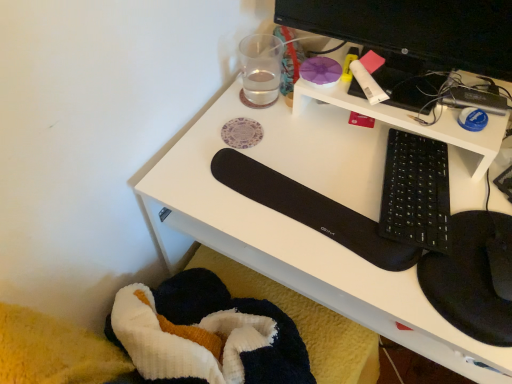
Question: Is white matte glue stick at upper right, arranged as the second stationery when viewed from the left, wider than transparent glass at upper center, the 1th stationery from the back?

Choices:
 (A) no
 (B) yes

Answer: (B)

Question: Is white matte glue stick at upper right, arranged as the second stationery when viewed from the left, at the left side of transparent glass at upper center, the 1th stationery from the back?

Choices:
 (A) yes
 (B) no

Answer: (B)

Question: From the image's perspective, is white matte glue stick at upper right, positioned as the first stationery in right-to-left order, below transparent glass at upper center, which is the 2th stationery from right to left?

Choices:
 (A) yes
 (B) no

Answer: (A)

Question: From a real-world perspective, is white matte glue stick at upper right, positioned as the first stationery in right-to-left order, positioned under transparent glass at upper center, which ranks as the second stationery in front-to-back order, based on gravity?

Choices:
 (A) yes
 (B) no

Answer: (B)

Question: Is white matte glue stick at upper right, positioned as the 1th stationery in front-to-back order, shorter than transparent glass at upper center, which ranks as the second stationery in front-to-back order?

Choices:
 (A) yes
 (B) no

Answer: (A)

Question: Is transparent glass at upper center, which is the 2th stationery from right to left, taller or shorter than black matte keyboard at center-right?

Choices:
 (A) tall
 (B) short

Answer: (A)

Question: Considering the relative positions of transparent glass at upper center, which is the 2th stationery from right to left, and black matte keyboard at center-right in the image provided, is transparent glass at upper center, which is the 2th stationery from right to left, to the left or to the right of black matte keyboard at center-right?

Choices:
 (A) left
 (B) right

Answer: (A)

Question: From the image's perspective, is transparent glass at upper center, the first stationery positioned from the left, positioned above or below black matte keyboard at center-right?

Choices:
 (A) below
 (B) above

Answer: (B)

Question: Is transparent glass at upper center, the first stationery positioned from the left, inside or outside of black matte keyboard at center-right?

Choices:
 (A) inside
 (B) outside

Answer: (B)

Question: In the image, is black glossy monitor at upper right on the left side or the right side of transparent glass at upper center, which ranks as the second stationery in front-to-back order?

Choices:
 (A) left
 (B) right

Answer: (B)

Question: Is black glossy monitor at upper right inside or outside of transparent glass at upper center, which is the 2th stationery from right to left?

Choices:
 (A) outside
 (B) inside

Answer: (A)

Question: Considering the positions of black glossy monitor at upper right and transparent glass at upper center, which is the 2th stationery from right to left, in the image, is black glossy monitor at upper right bigger or smaller than transparent glass at upper center, which is the 2th stationery from right to left,?

Choices:
 (A) small
 (B) big

Answer: (B)

Question: From the image's perspective, is black glossy monitor at upper right above or below transparent glass at upper center, which is the 2th stationery from right to left?

Choices:
 (A) above
 (B) below

Answer: (A)

Question: In terms of height, does black matte keyboard at center-right look taller or shorter compared to white matte glue stick at upper right, arranged as the second stationery when viewed from the left?

Choices:
 (A) tall
 (B) short

Answer: (A)

Question: In the image, is black matte keyboard at center-right on the left side or the right side of white matte glue stick at upper right, arranged as the second stationery when viewed from the left?

Choices:
 (A) right
 (B) left

Answer: (A)